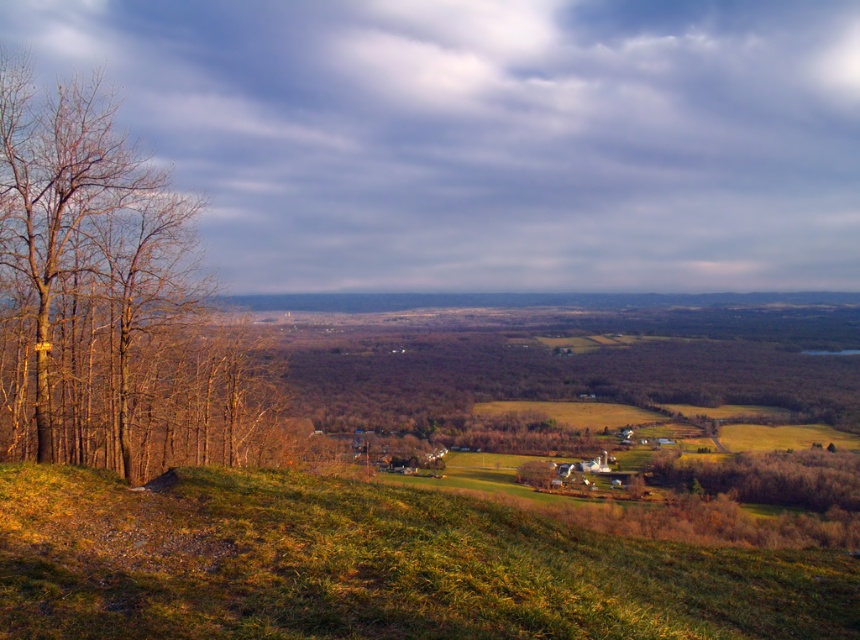
Question: Which point is farther to the camera?

Choices:
 (A) green matte tree at center
 (B) green grassy hillside at lower center
 (C) bare wood tree at left

Answer: (A)

Question: Can you confirm if bare wood tree at left is positioned above green matte tree at center?

Choices:
 (A) yes
 (B) no

Answer: (A)

Question: Is bare wood tree at left to the right of green matte tree at center from the viewer's perspective?

Choices:
 (A) no
 (B) yes

Answer: (A)

Question: Where is bare wood tree at left located in relation to green matte tree at center in the image?

Choices:
 (A) above
 (B) below

Answer: (A)

Question: Which object appears closest to the camera in this image?

Choices:
 (A) bare wood tree at left
 (B) green matte tree at center
 (C) green grassy hillside at lower center

Answer: (C)

Question: Which of the following is the farthest from the observer?

Choices:
 (A) bare wood tree at left
 (B) green grassy hillside at lower center

Answer: (A)